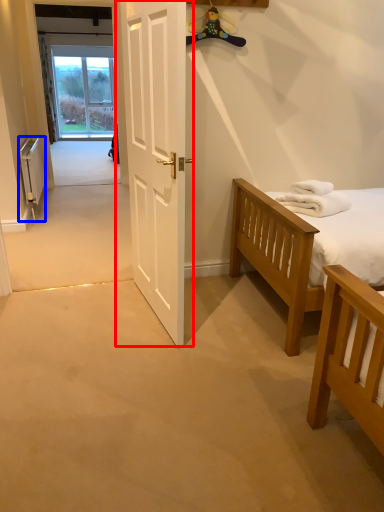
Question: Among these objects, which one is nearest to the camera, door (highlighted by a red box) or radiator (highlighted by a blue box)?

Choices:
 (A) door
 (B) radiator

Answer: (A)